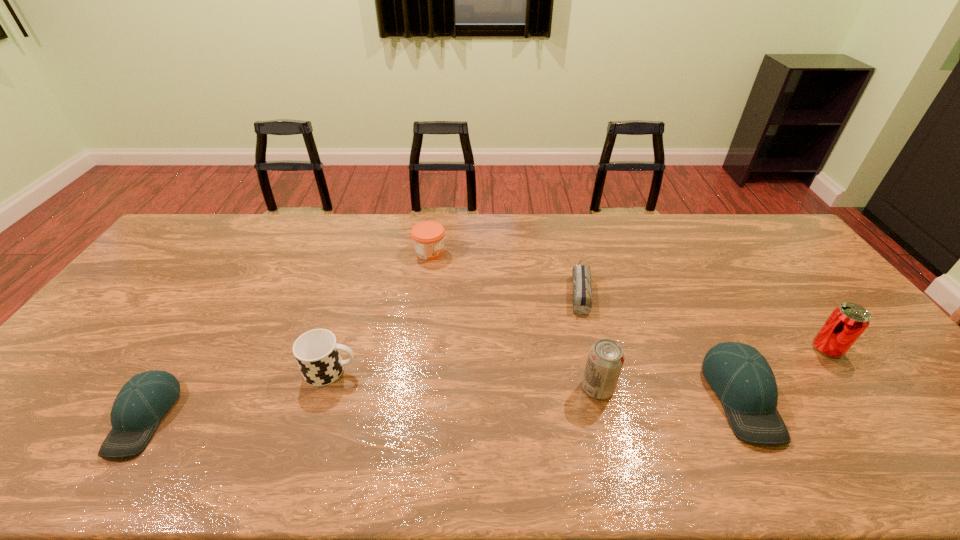
I want to click on free space between the second object from left to right and the nearer soda can, so 465,379.

You are a GUI agent. You are given a task and a screenshot of the screen. Output one action in this format:
    pyautogui.click(x=<x>, y=<y>)
    Task: Click on the vacant region between the left baseball cap and the pencil box
    The image size is (960, 540).
    Given the screenshot: What is the action you would take?
    pyautogui.click(x=362, y=354)

Locate an element on the screen. This screenshot has width=960, height=540. empty location between the left soda can and the farthest object is located at coordinates (514, 320).

Find the location of a particular element. This screenshot has width=960, height=540. empty space between the third object from left to right and the second shortest object is located at coordinates (287, 334).

Image resolution: width=960 pixels, height=540 pixels. I want to click on vacant space that is in between the second object from right to left and the jam, so click(x=586, y=325).

Image resolution: width=960 pixels, height=540 pixels. I want to click on empty space that is in between the leftmost object and the sixth object from right to left, so click(x=237, y=394).

Find the location of a particular element. The image size is (960, 540). blank region between the shorter baseball cap and the sixth object from right to left is located at coordinates (237, 394).

You are a GUI agent. You are given a task and a screenshot of the screen. Output one action in this format:
    pyautogui.click(x=<x>, y=<y>)
    Task: Click on the blank region between the farther soda can and the left baseball cap
    The height and width of the screenshot is (540, 960).
    Given the screenshot: What is the action you would take?
    pyautogui.click(x=486, y=383)

The height and width of the screenshot is (540, 960). I want to click on object that stands as the sixth closest to the right soda can, so click(141, 403).

Identify the location of the second closest object to the shortest object. (739, 374).